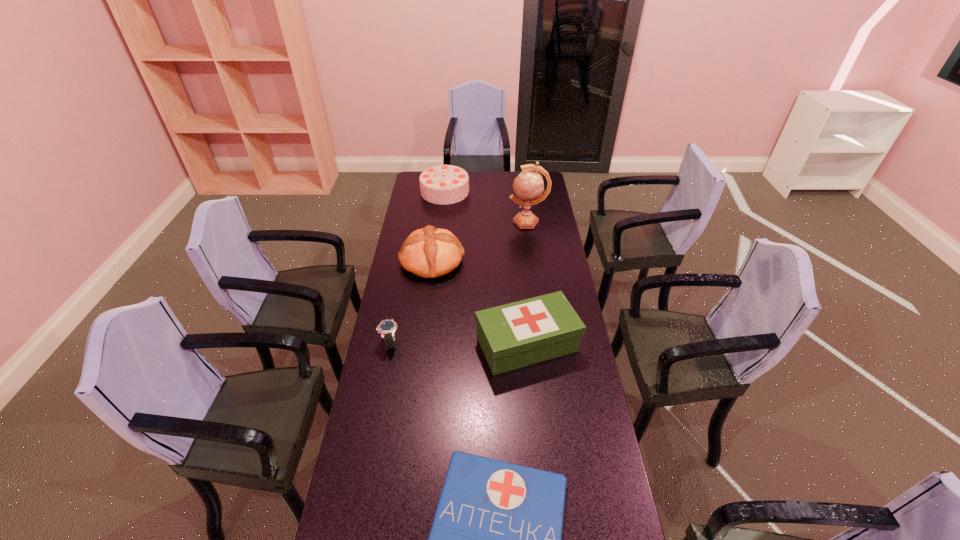
You are a GUI agent. You are given a task and a screenshot of the screen. Output one action in this format:
    pyautogui.click(x=<x>, y=<y>)
    Task: Click on the object that is the third closest to the second shortest object
    The image size is (960, 540).
    Given the screenshot: What is the action you would take?
    pyautogui.click(x=496, y=539)

I want to click on free space that satisfies the following two spatial constraints: 1. on the front-facing side of the second farthest object; 2. on the front side of the farther first-aid kit, so click(544, 345).

You are a GUI agent. You are given a task and a screenshot of the screen. Output one action in this format:
    pyautogui.click(x=<x>, y=<y>)
    Task: Click on the vacant space that satisfies the following two spatial constraints: 1. on the back side of the bread; 2. on the left side of the fifth tallest object
    This screenshot has height=540, width=960.
    Given the screenshot: What is the action you would take?
    pyautogui.click(x=405, y=261)

Find the location of a particular element. The image size is (960, 540). vacant region that satisfies the following two spatial constraints: 1. on the back side of the birthday cake; 2. on the right side of the watch is located at coordinates (420, 191).